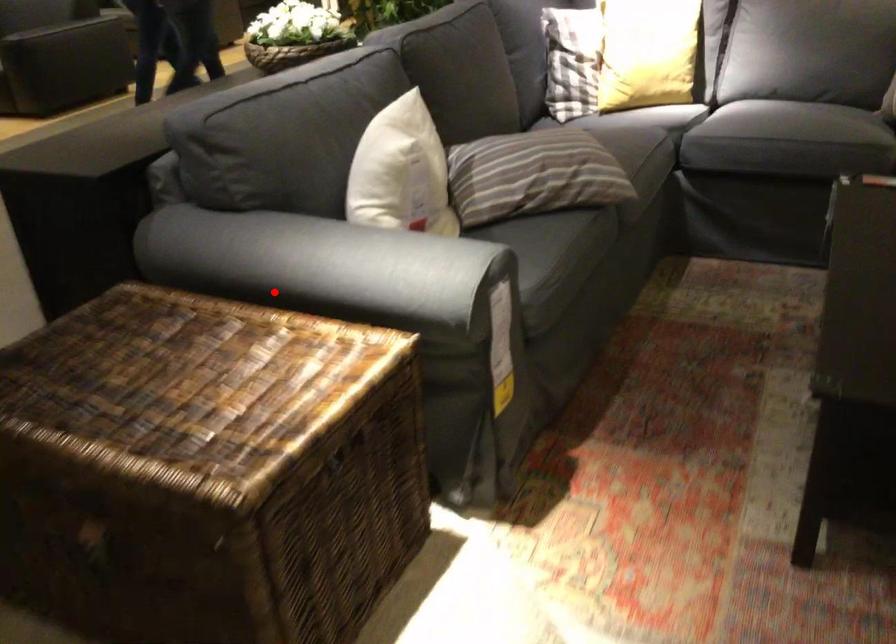
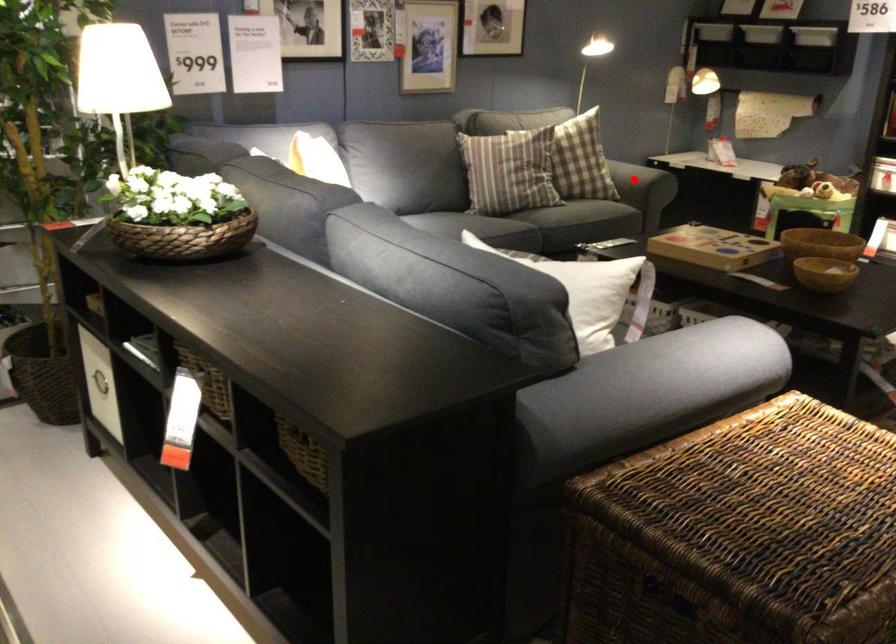
I am providing you with two images of the same scene from different viewpoints. A red point is marked on the first image and another point is marked on the second image. Are the points marked in image1 and image2 representing the same 3D position?

No